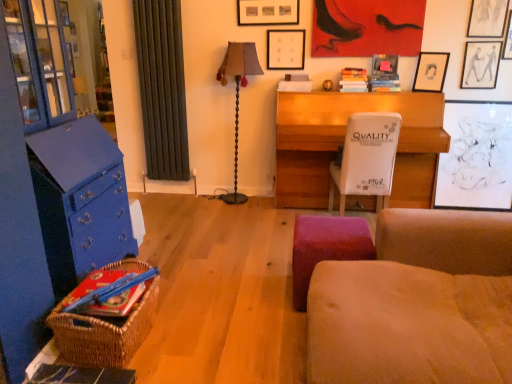
Question: Is matte black picture frame at upper right, acting as the 3th picture frame starting from the right, closer to the viewer compared to suede-like beige studio couch at lower right?

Choices:
 (A) yes
 (B) no

Answer: (B)

Question: Is matte black picture frame at upper right, acting as the fourth picture frame starting from the left, positioned beyond the bounds of suede-like beige studio couch at lower right?

Choices:
 (A) no
 (B) yes

Answer: (B)

Question: Is matte black picture frame at upper right, acting as the fourth picture frame starting from the left, shorter than suede-like beige studio couch at lower right?

Choices:
 (A) yes
 (B) no

Answer: (A)

Question: Is suede-like beige studio couch at lower right inside matte black picture frame at upper right, acting as the 3th picture frame starting from the right?

Choices:
 (A) yes
 (B) no

Answer: (B)

Question: Is matte black picture frame at upper right, acting as the fourth picture frame starting from the left, behind suede-like beige studio couch at lower right?

Choices:
 (A) no
 (B) yes

Answer: (B)

Question: Can you confirm if matte black picture frame at upper right, acting as the fourth picture frame starting from the left, is taller than suede-like beige studio couch at lower right?

Choices:
 (A) no
 (B) yes

Answer: (A)

Question: From a real-world perspective, is woven brown picnic basket at lower left located higher than blue painted wood cabinet at left?

Choices:
 (A) no
 (B) yes

Answer: (A)

Question: Is woven brown picnic basket at lower left facing away from blue painted wood cabinet at left?

Choices:
 (A) no
 (B) yes

Answer: (A)

Question: Considering the relative sizes of woven brown picnic basket at lower left and blue painted wood cabinet at left in the image provided, is woven brown picnic basket at lower left thinner than blue painted wood cabinet at left?

Choices:
 (A) no
 (B) yes

Answer: (B)

Question: From the image's perspective, would you say woven brown picnic basket at lower left is shown under blue painted wood cabinet at left?

Choices:
 (A) yes
 (B) no

Answer: (A)

Question: From the image's perspective, is woven brown picnic basket at lower left over blue painted wood cabinet at left?

Choices:
 (A) no
 (B) yes

Answer: (A)

Question: Does woven brown picnic basket at lower left have a smaller size compared to blue painted wood cabinet at left?

Choices:
 (A) yes
 (B) no

Answer: (A)

Question: Is woven brown picnic basket at lower left outside of velvet purple stool at lower center?

Choices:
 (A) yes
 (B) no

Answer: (A)